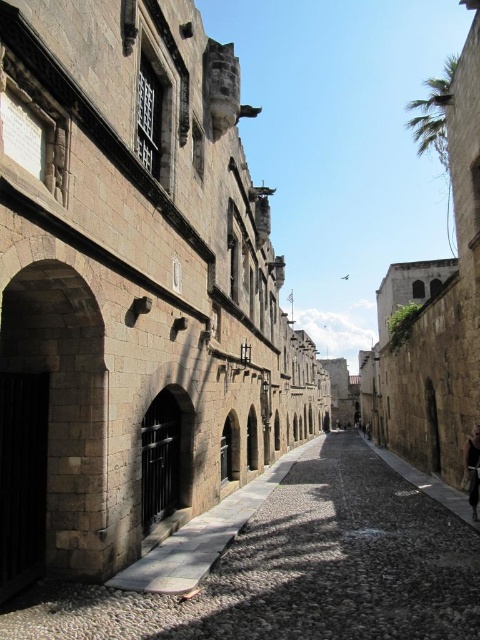
Question: Is stone paved alley at center closer to camera compared to dark brown leather jacket at lower right?

Choices:
 (A) no
 (B) yes

Answer: (B)

Question: Can you confirm if stone paved alley at center is bigger than dark brown leather jacket at lower right?

Choices:
 (A) no
 (B) yes

Answer: (B)

Question: Which point is farther to the camera?

Choices:
 (A) dark brown leather jacket at lower right
 (B) stone paved alley at center

Answer: (A)

Question: Observing the image, what is the correct spatial positioning of stone paved alley at center in reference to dark brown leather jacket at lower right?

Choices:
 (A) right
 (B) left

Answer: (B)

Question: Which point is farther from the camera taking this photo?

Choices:
 (A) (239, 614)
 (B) (467, 458)

Answer: (B)